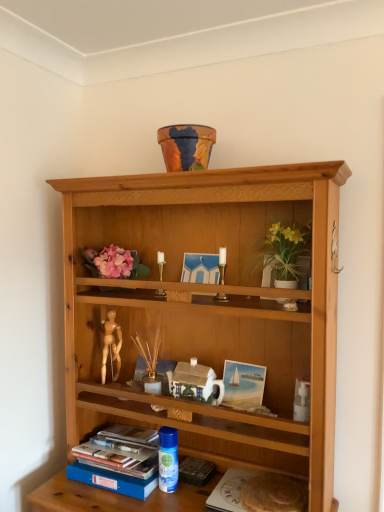
Question: From a real-world perspective, is blue hardcover book at lower left above or below white matte paper at lower center?

Choices:
 (A) above
 (B) below

Answer: (A)

Question: Choose the correct answer: Is blue hardcover book at lower left inside white matte paper at lower center or outside it?

Choices:
 (A) outside
 (B) inside

Answer: (A)

Question: Considering the real-world distances, which object is closest to the blue hardcover book at lower left?

Choices:
 (A) blue plastic spray can at lower center
 (B) white matte paper at lower center
 (C) white ceramic house at center
 (D) white ceramic vase at upper center
 (E) gold metallic candle holder at center, which is the second candle holder in back-to-front order

Answer: (A)

Question: Estimate the real-world distances between objects in this image. Which object is closer to the blue plastic spray can at lower center?

Choices:
 (A) white matte paper at lower center
 (B) gold metallic candle holder at center, the 2th candle holder viewed from the left
 (C) white ceramic vase at upper center
 (D) matte wooden picture frame at center
 (E) blue hardcover book at lower left

Answer: (E)